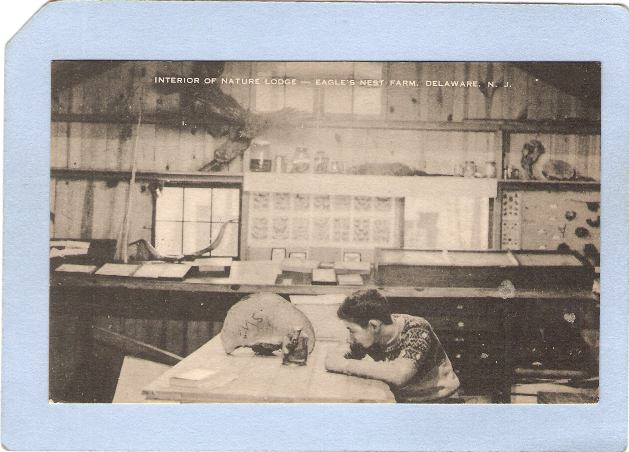
The height and width of the screenshot is (452, 629). I want to click on slanted ceiling, so click(x=75, y=70), click(x=580, y=73).